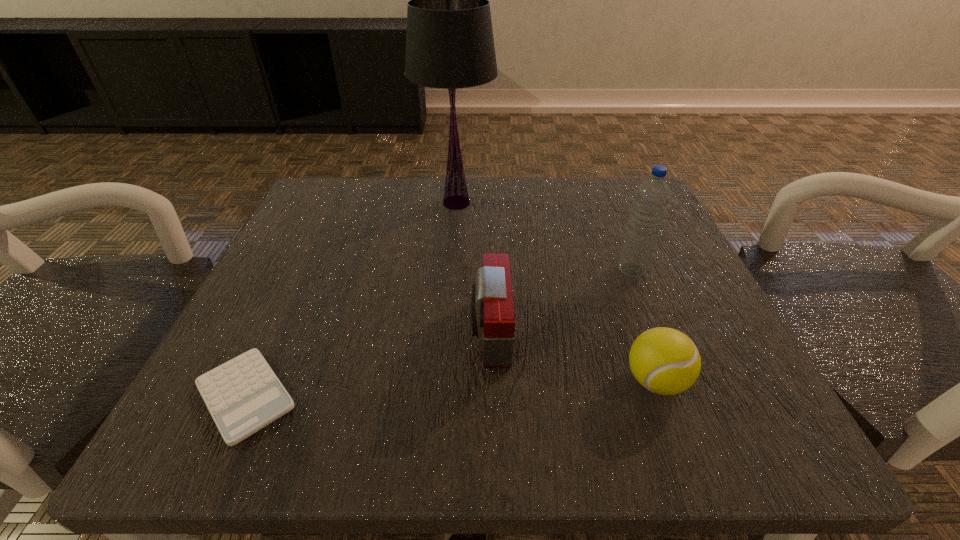
Locate an element on the screen. The height and width of the screenshot is (540, 960). tennis ball positioned at the right edge is located at coordinates (665, 361).

Locate an element on the screen. object that is positioned at the near left corner is located at coordinates (243, 395).

At what (x,y) coordinates should I click in order to perform the action: click on object at the near right corner. Please return your answer as a coordinate pair (x, y). Looking at the image, I should click on (665, 361).

Find the location of a particular element. vacant space at the far edge of the desktop is located at coordinates (502, 207).

At what (x,y) coordinates should I click in order to perform the action: click on vacant space at the near edge of the desktop. Please return your answer as a coordinate pair (x, y). The image size is (960, 540). Looking at the image, I should click on (377, 431).

Find the location of a particular element. vacant space at the left edge of the desktop is located at coordinates (288, 334).

In the image, there is a desktop. Where is `free space at the right edge`? This screenshot has height=540, width=960. free space at the right edge is located at coordinates (624, 323).

This screenshot has height=540, width=960. What are the coordinates of `vacant space at the far left corner of the desktop` in the screenshot? It's located at (381, 194).

At what (x,y) coordinates should I click in order to perform the action: click on free spot at the near left corner of the desktop. Please return your answer as a coordinate pair (x, y). Looking at the image, I should click on (311, 410).

Where is `vacant area at the far right corner of the desktop`? This screenshot has width=960, height=540. vacant area at the far right corner of the desktop is located at coordinates (613, 187).